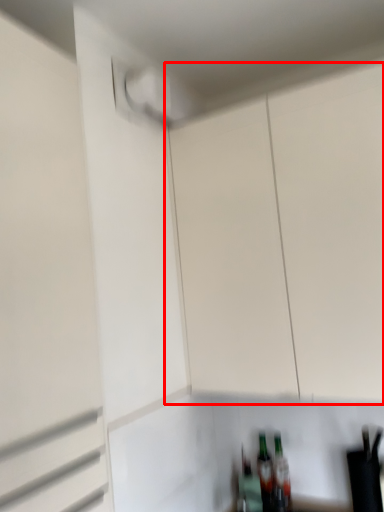
Question: Where is cabinetry (annotated by the red box) located in relation to garage door in the image?

Choices:
 (A) left
 (B) right

Answer: (B)